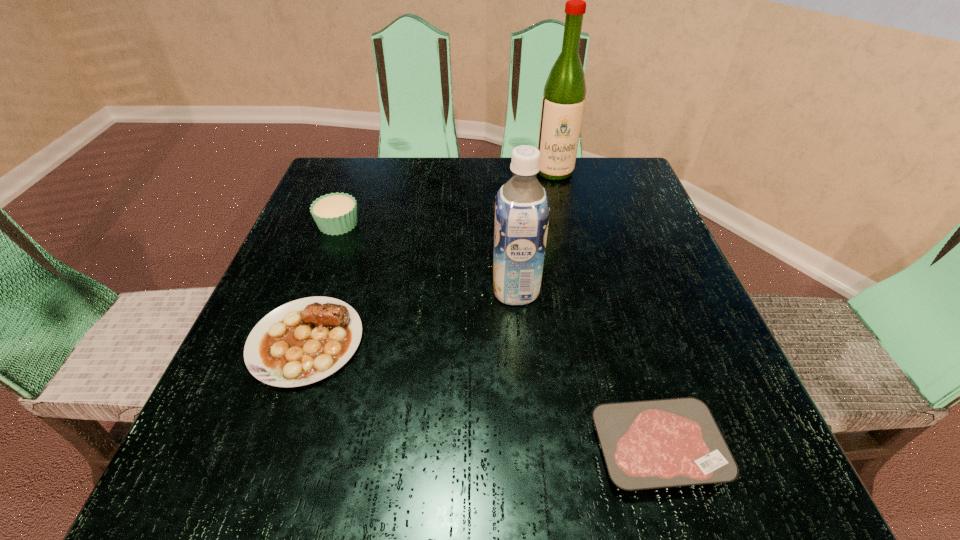
In the image, there is a desktop. At what (x,y) coordinates should I click in order to perform the action: click on vacant region at the right edge. Please return your answer as a coordinate pair (x, y). Image resolution: width=960 pixels, height=540 pixels. Looking at the image, I should click on (680, 268).

Find the location of a particular element. free space at the far left corner is located at coordinates (364, 211).

The width and height of the screenshot is (960, 540). What are the coordinates of `vacant space at the near left corner of the desktop` in the screenshot? It's located at (233, 477).

The image size is (960, 540). Identify the location of free space at the far right corner. (603, 163).

Locate an element on the screen. The image size is (960, 540). vacant point located between the soya milk and the shorter steak is located at coordinates (587, 369).

I want to click on vacant region between the fourth nearest object and the nearer steak, so click(x=498, y=336).

You are a GUI agent. You are given a task and a screenshot of the screen. Output one action in this format:
    pyautogui.click(x=<x>, y=<y>)
    Task: Click on the free space between the right steak and the fourth shortest object
    
    Given the screenshot: What is the action you would take?
    pyautogui.click(x=587, y=369)

Locate an element on the screen. The width and height of the screenshot is (960, 540). unoccupied position between the second farthest object and the left steak is located at coordinates tap(323, 282).

You are a GUI agent. You are given a task and a screenshot of the screen. Output one action in this format:
    pyautogui.click(x=<x>, y=<y>)
    Task: Click on the vacant area between the tallest object and the taller steak
    This screenshot has height=540, width=960.
    Given the screenshot: What is the action you would take?
    pyautogui.click(x=430, y=256)

The height and width of the screenshot is (540, 960). In order to click on vacant space in between the third tallest object and the soya milk in this screenshot , I will do `click(427, 257)`.